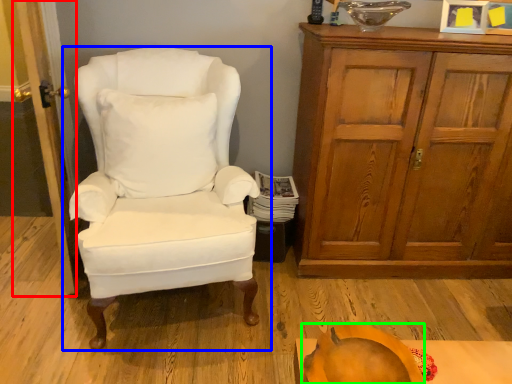
Question: Considering the real-world distances, which object is farthest from door (highlighted by a red box)? chair (highlighted by a blue box) or pumpkin (highlighted by a green box)?

Choices:
 (A) chair
 (B) pumpkin

Answer: (B)